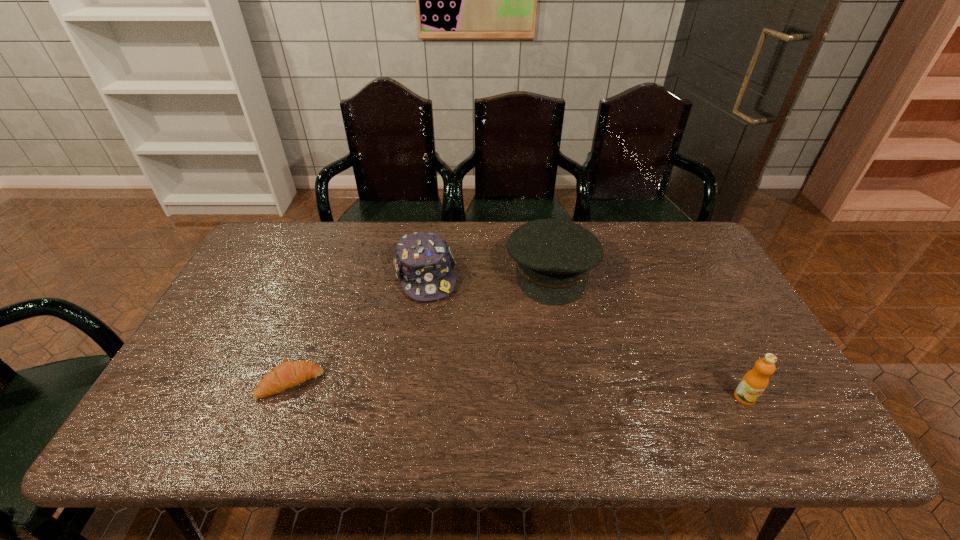
Image resolution: width=960 pixels, height=540 pixels. Find the location of `free spot on the desktop that is between the leftmost object and the rightmost object and is positioned on the front-facing side of the beret`. free spot on the desktop that is between the leftmost object and the rightmost object and is positioned on the front-facing side of the beret is located at coordinates (555, 391).

The image size is (960, 540). I want to click on free spot on the desktop that is between the crescent roll and the rightmost object and is positioned on the front-facing side of the third object from right to left, so click(462, 388).